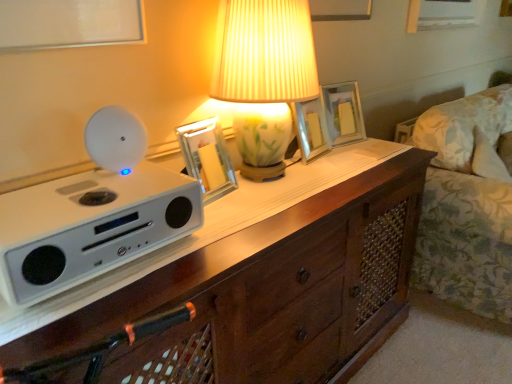
Question: Is metallic silver picture frame at center, which appears as the second picture frame when viewed from the back, oriented towards porcelain floral lamp at center?

Choices:
 (A) yes
 (B) no

Answer: (B)

Question: Is metallic silver picture frame at center, acting as the second picture frame starting from the front, to the right of porcelain floral lamp at center from the viewer's perspective?

Choices:
 (A) yes
 (B) no

Answer: (A)

Question: Is metallic silver picture frame at center, which appears as the second picture frame when viewed from the back, facing away from porcelain floral lamp at center?

Choices:
 (A) yes
 (B) no

Answer: (B)

Question: Is metallic silver picture frame at center, placed as the 2th picture frame when sorted from left to right, at the left side of porcelain floral lamp at center?

Choices:
 (A) no
 (B) yes

Answer: (A)

Question: Is metallic silver picture frame at center, acting as the second picture frame starting from the front, behind porcelain floral lamp at center?

Choices:
 (A) no
 (B) yes

Answer: (B)

Question: Is metallic silver picture frame at center, acting as the second picture frame starting from the front, spatially inside porcelain floral lamp at center, or outside of it?

Choices:
 (A) outside
 (B) inside

Answer: (A)

Question: Is metallic silver picture frame at center, which appears as the second picture frame when viewed from the back, in front of or behind porcelain floral lamp at center in the image?

Choices:
 (A) front
 (B) behind

Answer: (B)

Question: Considering the positions of point (290, 102) and point (275, 119), is point (290, 102) closer or farther from the camera than point (275, 119)?

Choices:
 (A) closer
 (B) farther

Answer: (A)

Question: From a real-world perspective, is metallic silver picture frame at center, which is the 2th picture frame from right to left, positioned above or below porcelain floral lamp at center?

Choices:
 (A) below
 (B) above

Answer: (A)

Question: Looking at their shapes, would you say matte glass picture frame at center, which appears as the third picture frame when viewed from the left, is wider or thinner than wooden chest of drawers at center?

Choices:
 (A) thin
 (B) wide

Answer: (A)

Question: In terms of size, does matte glass picture frame at center, which appears as the 1th picture frame when viewed from the back, appear bigger or smaller than wooden chest of drawers at center?

Choices:
 (A) small
 (B) big

Answer: (A)

Question: From a real-world perspective, is matte glass picture frame at center, which appears as the 3th picture frame when viewed from the front, positioned above or below wooden chest of drawers at center?

Choices:
 (A) below
 (B) above

Answer: (B)

Question: Considering the positions of point (351, 114) and point (217, 269), is point (351, 114) closer or farther from the camera than point (217, 269)?

Choices:
 (A) closer
 (B) farther

Answer: (B)

Question: Would you say white matte speaker at left is inside or outside metallic silver picture frame at center, which is counted as the 1th picture frame, starting from the left?

Choices:
 (A) outside
 (B) inside

Answer: (A)

Question: In the image, is white matte speaker at left positioned in front of or behind metallic silver picture frame at center, the 3th picture frame in the back-to-front sequence?

Choices:
 (A) front
 (B) behind

Answer: (A)